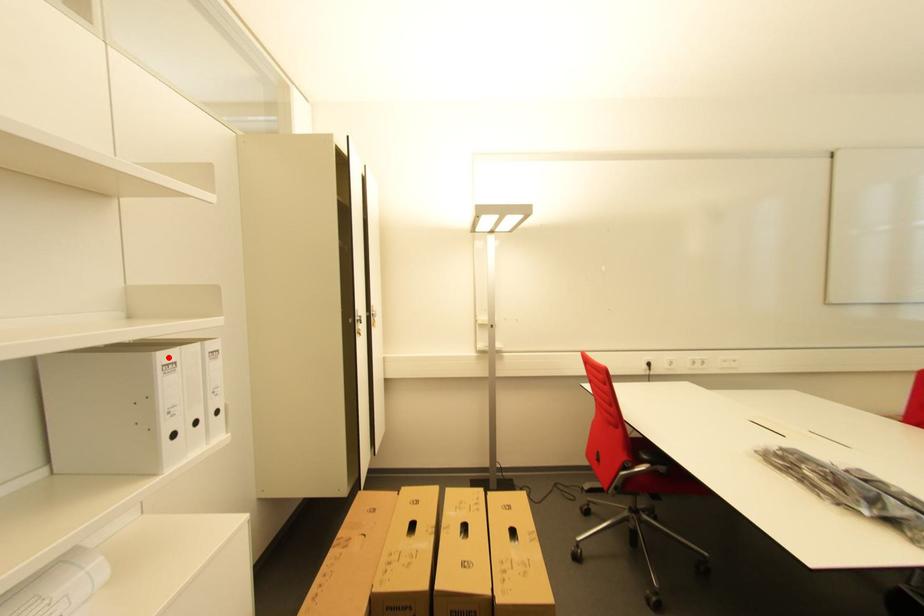
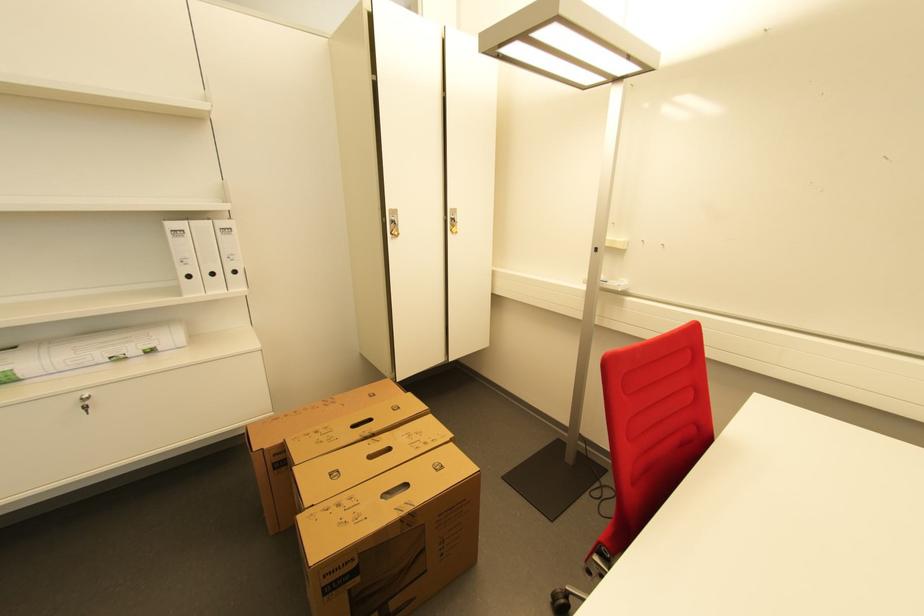
Where in the second image is the point corresponding to the highlighted location from the first image?

(176, 225)